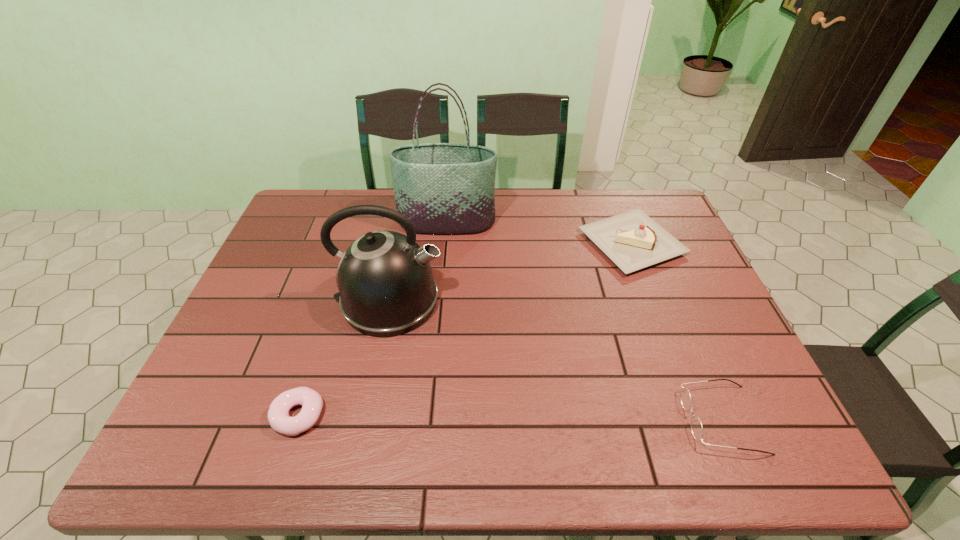
The width and height of the screenshot is (960, 540). I want to click on the tallest object, so click(x=442, y=188).

Find the location of a particular element. kettle is located at coordinates (386, 286).

I want to click on cake, so click(x=632, y=240).

The height and width of the screenshot is (540, 960). In order to click on spectacles in this screenshot , I will do `click(696, 426)`.

At what (x,y) coordinates should I click in order to perform the action: click on doughnut. Please return your answer as a coordinate pair (x, y). This screenshot has height=540, width=960. Looking at the image, I should click on pyautogui.click(x=278, y=415).

Find the location of a particular element. free space located 0.250m on the front of the tote bag is located at coordinates (441, 292).

I want to click on free region located 0.260m on the spout of the kettle, so click(539, 301).

Where is `free space located on the front of the cake`? This screenshot has height=540, width=960. free space located on the front of the cake is located at coordinates (663, 326).

Where is `free space located 0.240m through the lenses of the spectacles`? Image resolution: width=960 pixels, height=540 pixels. free space located 0.240m through the lenses of the spectacles is located at coordinates (575, 419).

Where is `blank area located through the lenses of the spectacles`? Image resolution: width=960 pixels, height=540 pixels. blank area located through the lenses of the spectacles is located at coordinates (525, 419).